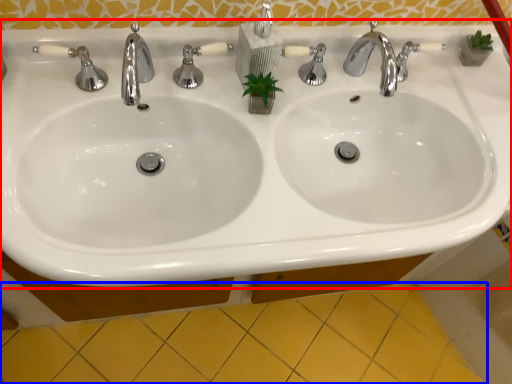
Question: Which object is closer to the camera taking this photo, sink (highlighted by a red box) or ceramic tile (highlighted by a blue box)?

Choices:
 (A) sink
 (B) ceramic tile

Answer: (A)